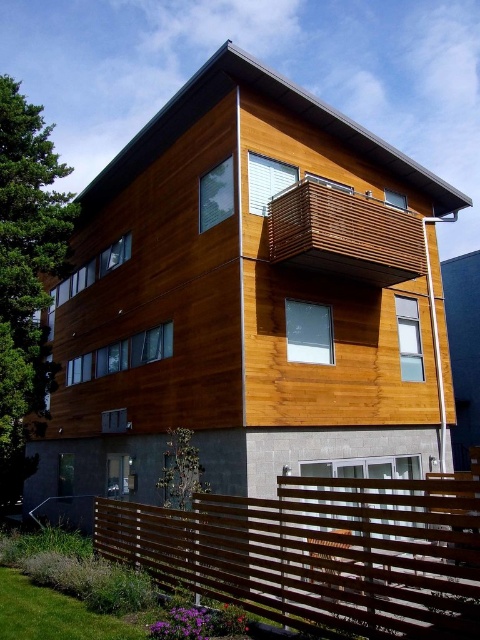
You are standing at the entrance of the modern two story building and want to find the brown wooden fence at lower center. Based on its coordinates, where should you look relative to the building?

The brown wooden fence at lower center is located at point 0.864 on the x axis and 0.667 on the y axis. Since the coordinates are based on the image, you should look towards the lower center area of the image to find the brown wooden fence at lower center.